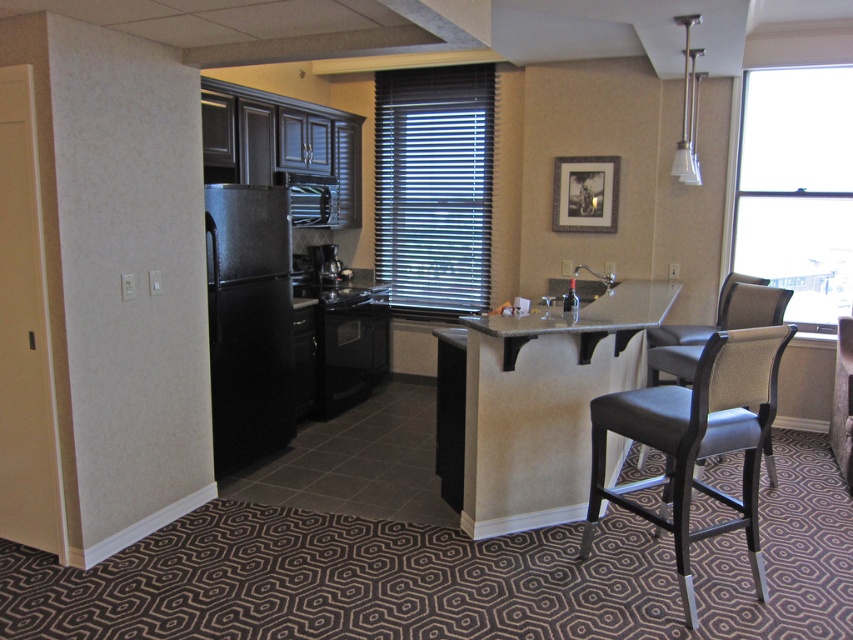
You are moving furniture into this kitchenette and need to place the black matte refrigerator at left and the dark gray fabric chair at right. Given their sizes, which one requires more space to accommodate?

The dark gray fabric chair at right requires more space because it is larger than the black matte refrigerator at left.

You are standing in the kitchenette and want to reach both points. Which point, point (553, 330) or point (323, 260), is closer to you?

Point (553, 330) is closer to the viewer than point (323, 260).